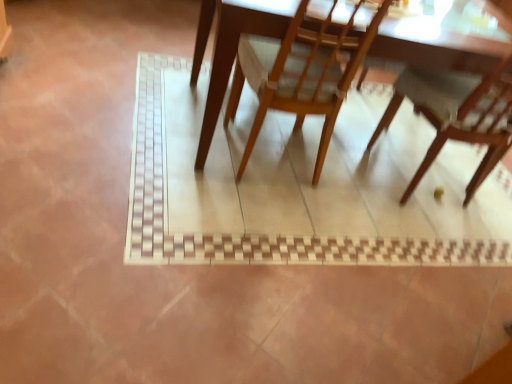
The image size is (512, 384). Identify the location of free space in front of wooden chair at center, which ranks as the 2th chair in right-to-left order. (214, 215).